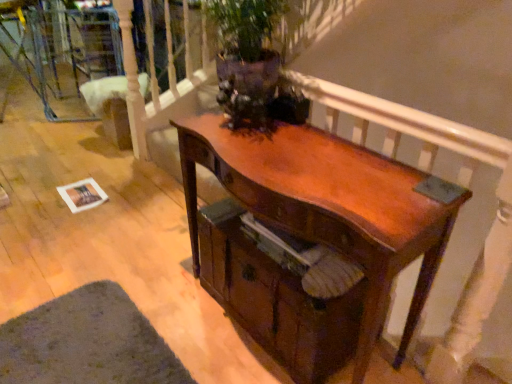
You are a GUI agent. You are given a task and a screenshot of the screen. Output one action in this format:
    pyautogui.click(x=<x>, y=<y>)
    Task: Click on the unoccupied area behind green felt mat at lower left
    The width and height of the screenshot is (512, 384).
    Given the screenshot: What is the action you would take?
    pyautogui.click(x=113, y=259)